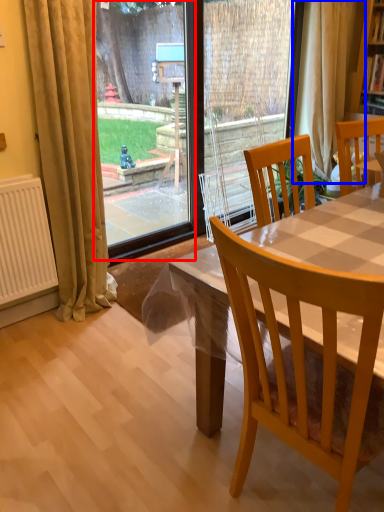
Question: Which object is closer to the camera taking this photo, glass door (highlighted by a red box) or curtain (highlighted by a blue box)?

Choices:
 (A) glass door
 (B) curtain

Answer: (A)